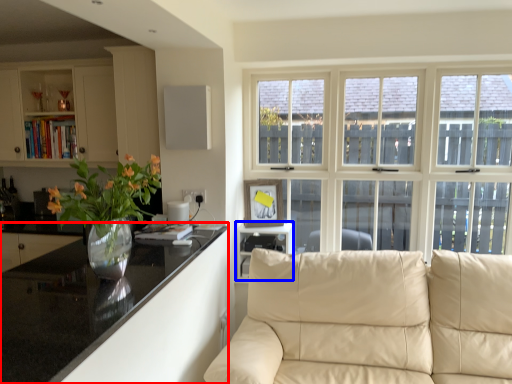
Question: Which object is closer to the camera taking this photo, countertop (highlighted by a red box) or shelf (highlighted by a blue box)?

Choices:
 (A) countertop
 (B) shelf

Answer: (A)